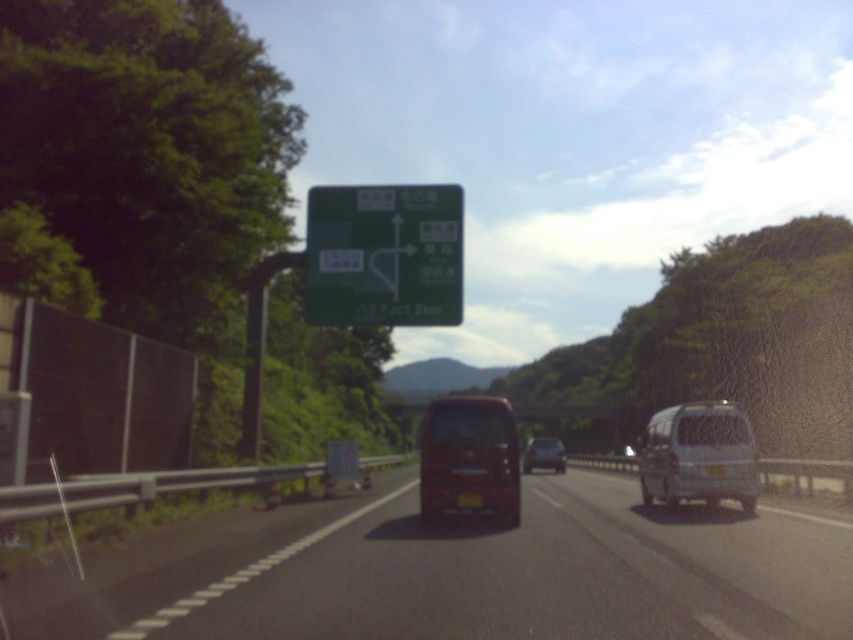
You are driving a matte black van at center and want to know if you can safely pass through the black rubber highway at center without hitting the edges. Can you confirm if the highway is wide enough?

The black rubber highway at center might be wider than matte black van at center, so there is a possibility that the highway is wide enough for the van to pass through without hitting the edges. However, the exact width difference is not specified, so caution is advised.

You are a driver approaching the highway and see the metallic red bus at center and the silver metallic van at right. Which vehicle is shorter in height?

The metallic red bus at center is not as tall as the silver metallic van at right, so the metallic red bus at center is shorter in height.

You are a delivery driver planning to pass a large truck ahead. You see a matte black van at center and a white plastic license plate at center. Which object is wider?

The matte black van at center is wider than the white plastic license plate at center.